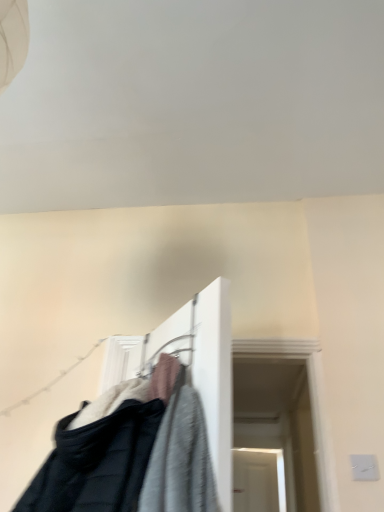
Question: Is black fabric clothesline at lower left beside textured fabric clothes at center?

Choices:
 (A) no
 (B) yes

Answer: (A)

Question: From a real-world perspective, is black fabric clothesline at lower left physically below textured fabric clothes at center?

Choices:
 (A) no
 (B) yes

Answer: (A)

Question: Would you say black fabric clothesline at lower left contains textured fabric clothes at center?

Choices:
 (A) no
 (B) yes

Answer: (A)

Question: Is black fabric clothesline at lower left thinner than textured fabric clothes at center?

Choices:
 (A) no
 (B) yes

Answer: (B)

Question: Is black fabric clothesline at lower left positioned behind textured fabric clothes at center?

Choices:
 (A) yes
 (B) no

Answer: (A)

Question: Is black fabric clothesline at lower left at the left side of textured fabric clothes at center?

Choices:
 (A) no
 (B) yes

Answer: (B)

Question: Is textured fabric clothes at center facing away from black fabric clothesline at lower left?

Choices:
 (A) no
 (B) yes

Answer: (A)

Question: Does textured fabric clothes at center have a smaller size compared to black fabric clothesline at lower left?

Choices:
 (A) no
 (B) yes

Answer: (A)

Question: Is textured fabric clothes at center closer to the viewer compared to black fabric clothesline at lower left?

Choices:
 (A) no
 (B) yes

Answer: (B)

Question: Considering the relative sizes of textured fabric clothes at center and black fabric clothesline at lower left in the image provided, is textured fabric clothes at center bigger than black fabric clothesline at lower left?

Choices:
 (A) yes
 (B) no

Answer: (A)

Question: Are textured fabric clothes at center and black fabric clothesline at lower left far apart?

Choices:
 (A) yes
 (B) no

Answer: (B)

Question: Can you confirm if textured fabric clothes at center is shorter than black fabric clothesline at lower left?

Choices:
 (A) no
 (B) yes

Answer: (B)

Question: In terms of width, does black fabric clothesline at lower left look wider or thinner when compared to textured fabric clothes at center?

Choices:
 (A) wide
 (B) thin

Answer: (B)